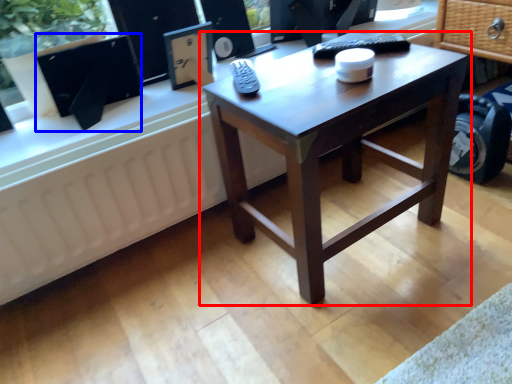
Question: Which of the following is the closest to the observer, coffee table (highlighted by a red box) or computer monitor (highlighted by a blue box)?

Choices:
 (A) coffee table
 (B) computer monitor

Answer: (A)